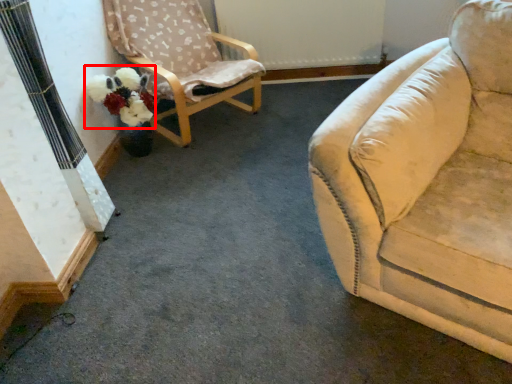
Question: Where is flower (annotated by the red box) located in relation to chair in the image?

Choices:
 (A) left
 (B) right

Answer: (A)